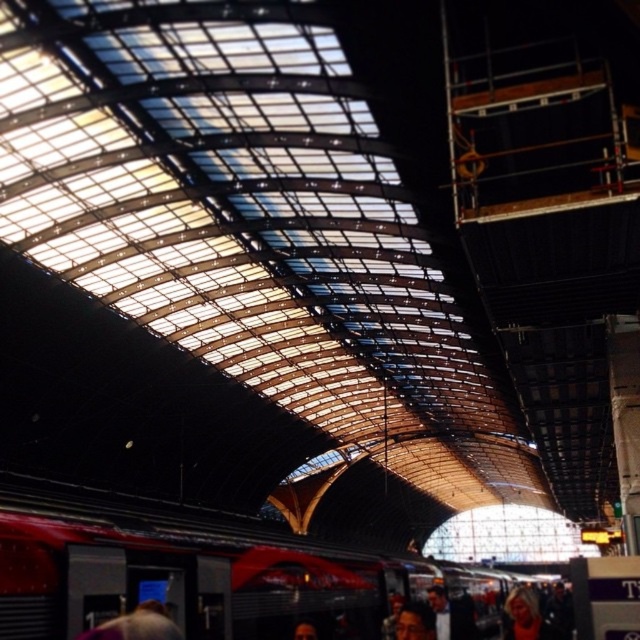
Between red metallic train at center and blonde hair at lower right, which one appears on the right side from the viewer's perspective?

blonde hair at lower right is more to the right.

Does red metallic train at center appear on the left side of blonde hair at lower right?

Indeed, red metallic train at center is positioned on the left side of blonde hair at lower right.

At what (x,y) coordinates should I click in order to perform the action: click on red metallic train at center. Please return your answer as a coordinate pair (x, y). The height and width of the screenshot is (640, 640). Looking at the image, I should click on (205, 577).

Can you confirm if red metallic train at center is bigger than smooth brown hair at lower center?

Correct, red metallic train at center is larger in size than smooth brown hair at lower center.

What do you see at coordinates (205, 577) in the screenshot? The image size is (640, 640). I see `red metallic train at center` at bounding box center [205, 577].

Does point (202, 616) lie in front of point (433, 616)?

Yes.

Where is `red metallic train at center`? red metallic train at center is located at coordinates (205, 577).

Who is higher up, blonde hair at lower right or smooth brown hair at lower center?

Positioned higher is smooth brown hair at lower center.

At what (x,y) coordinates should I click in order to perform the action: click on blonde hair at lower right. Please return your answer as a coordinate pair (x, y). The height and width of the screenshot is (640, 640). Looking at the image, I should click on (522, 614).